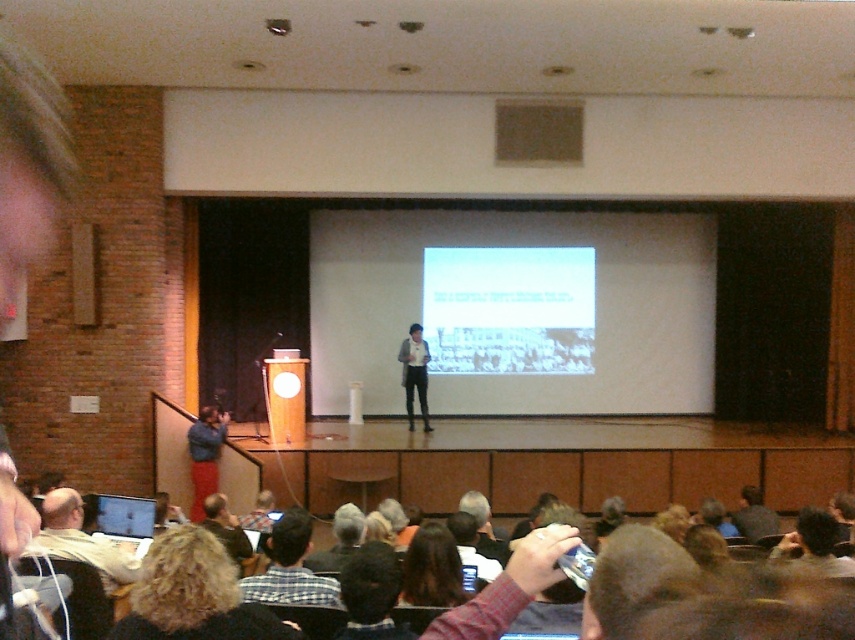
Who is shorter, plaid shirt at center or dark brown hair at center?

With less height is dark brown hair at center.

Is plaid shirt at center bigger than dark brown hair at center?

Correct, plaid shirt at center is larger in size than dark brown hair at center.

Is point (311, 573) less distant than point (423, 589)?

No, (311, 573) is further to viewer.

This screenshot has width=855, height=640. What are the coordinates of `plaid shirt at center` in the screenshot? It's located at (290, 568).

Who is taller, curly hair at lower left or white shirt at center?

white shirt at center is taller.

Who is positioned more to the left, curly hair at lower left or white shirt at center?

Positioned to the left is curly hair at lower left.

Is point (210, 636) positioned in front of point (404, 340)?

Yes, point (210, 636) is closer to viewer.

The height and width of the screenshot is (640, 855). What are the coordinates of `curly hair at lower left` in the screenshot? It's located at (193, 595).

Is curly hair at lower left taller than plaid shirt at center?

Yes.

Who is more distant from viewer, (180, 536) or (319, 595)?

Positioned behind is point (319, 595).

Find the location of a particular element. Image resolution: width=855 pixels, height=640 pixels. curly hair at lower left is located at coordinates (193, 595).